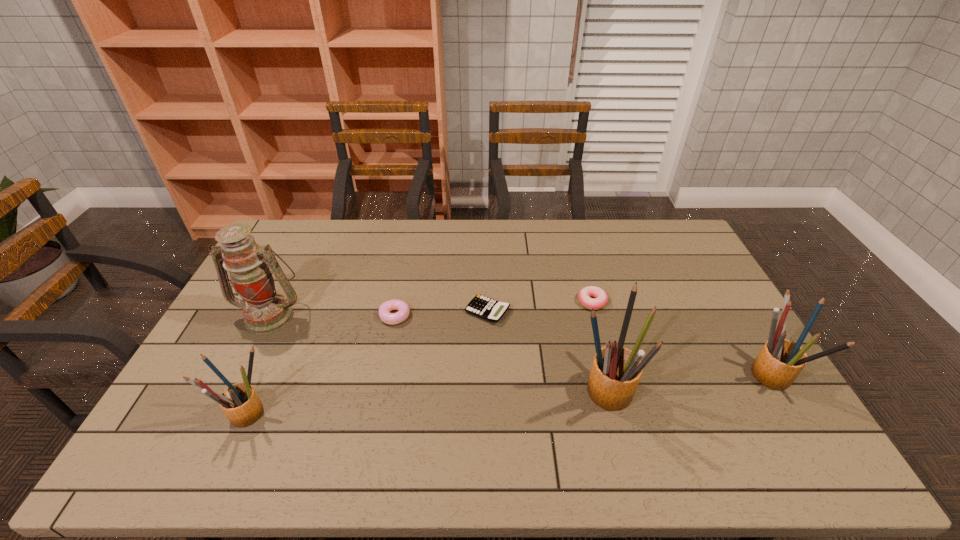
The height and width of the screenshot is (540, 960). I want to click on free space located 0.210m on the back of the shortest pencil box, so click(x=281, y=334).

This screenshot has width=960, height=540. I want to click on vacant region located on the left of the second pencil box from left to right, so click(470, 387).

In order to click on vacant space located on the left of the rightmost pencil box in this screenshot , I will do `click(719, 375)`.

Locate an element on the screen. free space located 0.070m on the back of the oil lamp is located at coordinates (286, 284).

Find the location of a particular element. free space located 0.250m on the back of the left doughnut is located at coordinates (407, 257).

Locate an element on the screen. The width and height of the screenshot is (960, 540). vacant region located 0.080m on the front of the calculator is located at coordinates (489, 346).

I want to click on free space located 0.270m on the right of the right doughnut, so click(690, 302).

The image size is (960, 540). I want to click on pencil box that is at the left edge, so click(x=240, y=403).

Locate an element on the screen. The width and height of the screenshot is (960, 540). oil lamp that is at the left edge is located at coordinates (265, 311).

Where is `object located in the right edge section of the desktop`? object located in the right edge section of the desktop is located at coordinates (780, 361).